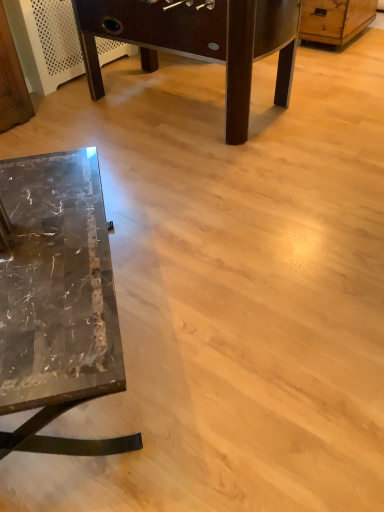
The height and width of the screenshot is (512, 384). Identify the location of free region under marble table at lower left, which is the 1th table in top-to-bottom order (from a real-world perspective). (177, 105).